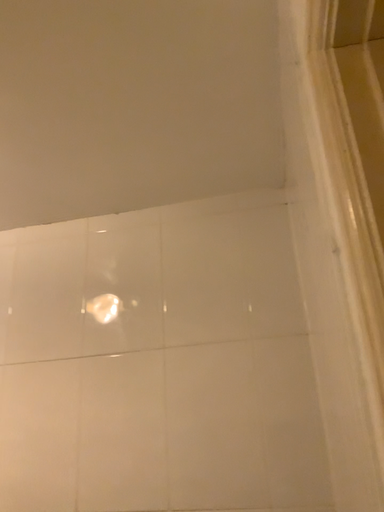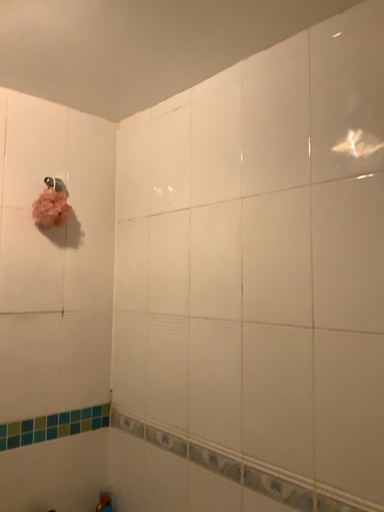
Question: How did the camera likely rotate when shooting the video?

Choices:
 (A) rotated downward
 (B) rotated upward

Answer: (A)